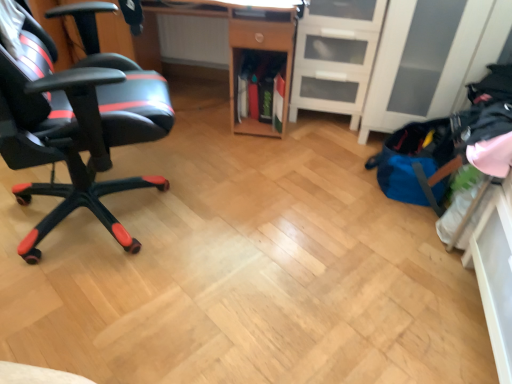
Question: Is white matte file cabinet at center right shorter than wooden desk at center?

Choices:
 (A) no
 (B) yes

Answer: (B)

Question: Is white matte file cabinet at center right with wooden desk at center?

Choices:
 (A) yes
 (B) no

Answer: (B)

Question: Is white matte file cabinet at center right in front of wooden desk at center?

Choices:
 (A) yes
 (B) no

Answer: (B)

Question: Is white matte file cabinet at center right located outside wooden desk at center?

Choices:
 (A) yes
 (B) no

Answer: (A)

Question: Is white matte file cabinet at center right oriented towards wooden desk at center?

Choices:
 (A) yes
 (B) no

Answer: (B)

Question: In the image, is white matte file cabinet at center right on the left side or the right side of wooden desk at center?

Choices:
 (A) right
 (B) left

Answer: (A)

Question: Considering the positions of white matte file cabinet at center right and wooden desk at center in the image, is white matte file cabinet at center right wider or thinner than wooden desk at center?

Choices:
 (A) thin
 (B) wide

Answer: (A)

Question: Considering the positions of white matte file cabinet at center right and wooden desk at center in the image, is white matte file cabinet at center right bigger or smaller than wooden desk at center?

Choices:
 (A) small
 (B) big

Answer: (A)

Question: Does point (324, 33) appear closer or farther from the camera than point (287, 46)?

Choices:
 (A) closer
 (B) farther

Answer: (B)

Question: From their relative heights in the image, would you say wooden desk at center is taller or shorter than white matte file cabinet at center right?

Choices:
 (A) short
 (B) tall

Answer: (B)

Question: From a real-world perspective, is wooden desk at center physically located above or below white matte file cabinet at center right?

Choices:
 (A) below
 (B) above

Answer: (B)

Question: Considering their positions, is wooden desk at center located in front of or behind white matte file cabinet at center right?

Choices:
 (A) front
 (B) behind

Answer: (A)

Question: From the image's perspective, is wooden desk at center located above or below white matte file cabinet at center right?

Choices:
 (A) above
 (B) below

Answer: (B)

Question: Considering their positions, is wooden desk at center located in front of or behind black matte gaming chair at left?

Choices:
 (A) front
 (B) behind

Answer: (B)

Question: In terms of height, does wooden desk at center look taller or shorter compared to black matte gaming chair at left?

Choices:
 (A) short
 (B) tall

Answer: (A)